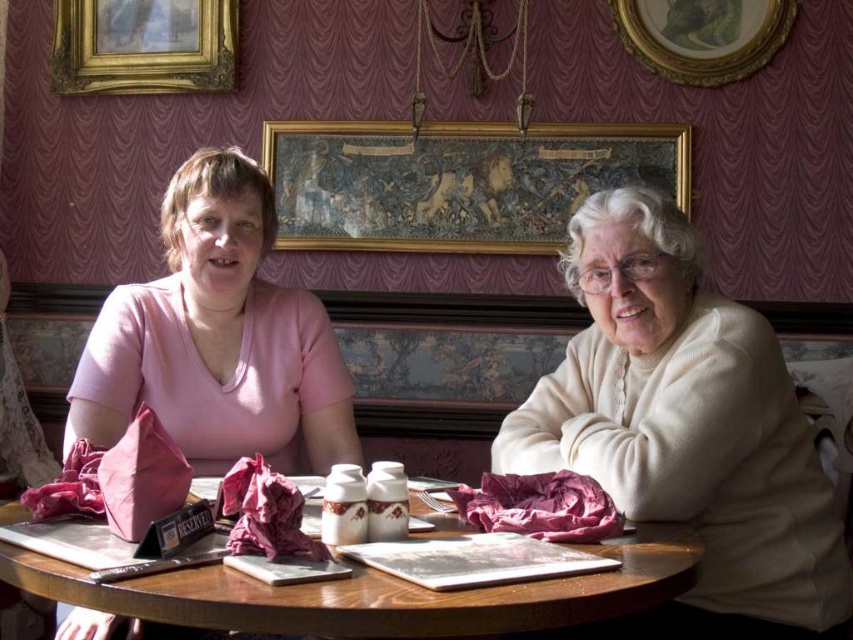
Question: Which object is the farthest from the gold-framed picture at upper center?

Choices:
 (A) matte pink sweater at left
 (B) wooden table at center

Answer: (B)

Question: Among these objects, which one is farthest from the camera?

Choices:
 (A) wooden table at center
 (B) white woolen sweater at right
 (C) matte pink sweater at left
 (D) gold-framed picture at upper center

Answer: (D)

Question: Can you confirm if white woolen sweater at right is positioned to the left of gold-framed tapestry at upper center?

Choices:
 (A) yes
 (B) no

Answer: (B)

Question: Based on their relative distances, which object is nearer to the gold-framed tapestry at upper center?

Choices:
 (A) wooden table at center
 (B) matte pink sweater at left
 (C) white woolen sweater at right
 (D) gold ornate picture frame at upper left

Answer: (D)

Question: Can you confirm if white woolen sweater at right is bigger than wooden table at center?

Choices:
 (A) yes
 (B) no

Answer: (A)

Question: Does white woolen sweater at right lie behind gold ornate picture frame at upper left?

Choices:
 (A) no
 (B) yes

Answer: (A)